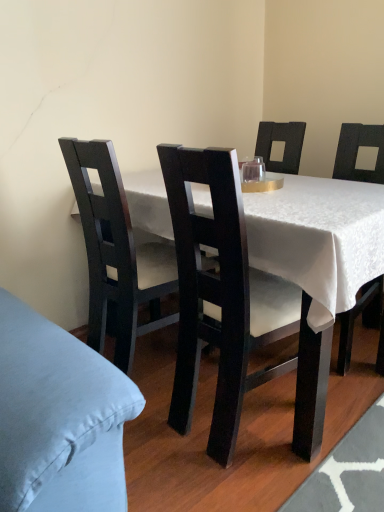
Describe the element at coordinates (233, 308) in the screenshot. I see `matte black chair at center, which is the first chair from right to left` at that location.

Where is `matte black chair at center, which is the first chair from left to right`? matte black chair at center, which is the first chair from left to right is located at coordinates (116, 254).

Considering the sizes of transparent glass at center and matte black chair at center, marked as the second chair in a left-to-right arrangement, in the image, is transparent glass at center wider or thinner than matte black chair at center, marked as the second chair in a left-to-right arrangement,?

transparent glass at center is thinner than matte black chair at center, marked as the second chair in a left-to-right arrangement.

Who is shorter, transparent glass at center or matte black chair at center, marked as the second chair in a left-to-right arrangement?

Standing shorter between the two is transparent glass at center.

Measure the distance from transparent glass at center to matte black chair at center, marked as the second chair in a left-to-right arrangement.

transparent glass at center and matte black chair at center, marked as the second chair in a left-to-right arrangement, are 23.81 inches apart from each other.

Is matte black table at center to the right of matte black chair at center, positioned as the 2th chair in right-to-left order, from the viewer's perspective?

Correct, you'll find matte black table at center to the right of matte black chair at center, positioned as the 2th chair in right-to-left order.

From the image's perspective, does matte black table at center appear lower than matte black chair at center, positioned as the 2th chair in right-to-left order?

Yes, from the image's perspective, matte black table at center is beneath matte black chair at center, positioned as the 2th chair in right-to-left order.

Considering the positions of objects matte black table at center and matte black chair at center, which is the first chair from left to right, in the image provided, who is in front, matte black table at center or matte black chair at center, which is the first chair from left to right,?

matte black table at center is closer to the camera.

Considering the relative sizes of matte black chair at center, which is the first chair from right to left, and transparent glass at center in the image provided, is matte black chair at center, which is the first chair from right to left, thinner than transparent glass at center?

No, matte black chair at center, which is the first chair from right to left, is not thinner than transparent glass at center.

Between matte black chair at center, marked as the second chair in a left-to-right arrangement, and transparent glass at center, which one appears on the left side from the viewer's perspective?

matte black chair at center, marked as the second chair in a left-to-right arrangement, is more to the left.

Does matte black chair at center, marked as the second chair in a left-to-right arrangement, have a smaller size compared to transparent glass at center?

Actually, matte black chair at center, marked as the second chair in a left-to-right arrangement, might be larger than transparent glass at center.

Is matte black chair at center, which is the first chair from left to right, turned away from transparent glass at center?

matte black chair at center, which is the first chair from left to right, is not turned away from transparent glass at center.

Who is shorter, matte black chair at center, which is the first chair from left to right, or transparent glass at center?

transparent glass at center.

Is point (111, 242) farther from viewer compared to point (261, 162)?

No.

Is matte black chair at center, positioned as the 2th chair in right-to-left order, not within transparent glass at center?

Yes, matte black chair at center, positioned as the 2th chair in right-to-left order, is not within transparent glass at center.

Which of these two, matte black chair at center, positioned as the 2th chair in right-to-left order, or matte black table at center, stands taller?

matte black chair at center, positioned as the 2th chair in right-to-left order.

Between matte black chair at center, positioned as the 2th chair in right-to-left order, and matte black table at center, which one has larger size?

matte black table at center.

From a real-world perspective, between matte black chair at center, which is the first chair from left to right, and matte black table at center, who is vertically lower?

From a 3D spatial view, matte black table at center is below.

Which is more to the left, matte black chair at center, marked as the second chair in a left-to-right arrangement, or matte black chair at center, which is the first chair from left to right?

matte black chair at center, which is the first chair from left to right, is more to the left.

From the image's perspective, who appears lower, matte black chair at center, marked as the second chair in a left-to-right arrangement, or matte black chair at center, which is the first chair from left to right?

matte black chair at center, marked as the second chair in a left-to-right arrangement.

Find the location of `chair that is above the matte black chair at center, marked as the second chair in a left-to-right arrangement (from the image's perspective)`. chair that is above the matte black chair at center, marked as the second chair in a left-to-right arrangement (from the image's perspective) is located at coordinates click(x=116, y=254).

Does matte black chair at center, marked as the second chair in a left-to-right arrangement, have a lesser height compared to matte black chair at center, which is the first chair from left to right?

No, matte black chair at center, marked as the second chair in a left-to-right arrangement, is not shorter than matte black chair at center, which is the first chair from left to right.

From the image's perspective, relative to matte black chair at center, which is the first chair from right to left, is matte black chair at center, which is the first chair from left to right, above or below?

matte black chair at center, which is the first chair from left to right, is above matte black chair at center, which is the first chair from right to left.

Does point (62, 139) come farther from viewer compared to point (308, 454)?

Yes, it is.

Is matte black chair at center, which is the first chair from left to right, aimed at matte black chair at center, marked as the second chair in a left-to-right arrangement?

No, matte black chair at center, which is the first chair from left to right, is not aimed at matte black chair at center, marked as the second chair in a left-to-right arrangement.

Which of these two, matte black chair at center, positioned as the 2th chair in right-to-left order, or matte black chair at center, which is the first chair from right to left, stands taller?

Standing taller between the two is matte black chair at center, which is the first chair from right to left.

Where is `coffee cup that is above the matte black chair at center, which is the first chair from right to left (from the image's perspective)`? This screenshot has height=512, width=384. coffee cup that is above the matte black chair at center, which is the first chair from right to left (from the image's perspective) is located at coordinates (253, 170).

Starting from the matte black table at center, which chair is the 2nd one to the left? Please provide its 2D coordinates.

[(116, 254)]

Which object lies further to the anchor point transparent glass at center, matte black table at center or matte black chair at center, positioned as the 2th chair in right-to-left order?

matte black chair at center, positioned as the 2th chair in right-to-left order, is further to transparent glass at center.

When comparing their distances from transparent glass at center, does matte black chair at center, positioned as the 2th chair in right-to-left order, or matte black chair at center, which is the first chair from right to left, seem further?

matte black chair at center, positioned as the 2th chair in right-to-left order, lies further to transparent glass at center than the other object.

Estimate the real-world distances between objects in this image. Which object is closer to matte black chair at center, which is the first chair from left to right, matte black chair at center, which is the first chair from right to left, or matte black table at center?

matte black table at center is positioned closer to the anchor matte black chair at center, which is the first chair from left to right.

Based on their spatial positions, is matte black table at center or transparent glass at center closer to matte black chair at center, which is the first chair from left to right?

Based on the image, matte black table at center appears to be nearer to matte black chair at center, which is the first chair from left to right.

Based on their spatial positions, is matte black chair at center, which is the first chair from left to right, or matte black table at center further from matte black chair at center, which is the first chair from right to left?

Based on the image, matte black chair at center, which is the first chair from left to right, appears to be further to matte black chair at center, which is the first chair from right to left.

Which object lies further to the anchor point matte black table at center, matte black chair at center, marked as the second chair in a left-to-right arrangement, or matte black chair at center, positioned as the 2th chair in right-to-left order?

matte black chair at center, positioned as the 2th chair in right-to-left order, is further to matte black table at center.

Looking at the image, which one is located closer to matte black table at center, matte black chair at center, positioned as the 2th chair in right-to-left order, or transparent glass at center?

The object closer to matte black table at center is matte black chair at center, positioned as the 2th chair in right-to-left order.

Estimate the real-world distances between objects in this image. Which object is further from matte black chair at center, positioned as the 2th chair in right-to-left order, matte black chair at center, marked as the second chair in a left-to-right arrangement, or transparent glass at center?

The object further to matte black chair at center, positioned as the 2th chair in right-to-left order, is transparent glass at center.

I want to click on desk between matte black chair at center, which is the first chair from right to left, and transparent glass at center from front to back, so click(x=319, y=239).

Locate an element on the screen. chair between matte black table at center and transparent glass at center in the front-back direction is located at coordinates (116, 254).

Identify the location of chair between matte black chair at center, marked as the second chair in a left-to-right arrangement, and transparent glass at center, along the z-axis. This screenshot has width=384, height=512. (116, 254).

The height and width of the screenshot is (512, 384). Identify the location of chair located between matte black chair at center, which is the first chair from left to right, and matte black table at center in the left-right direction. (233, 308).